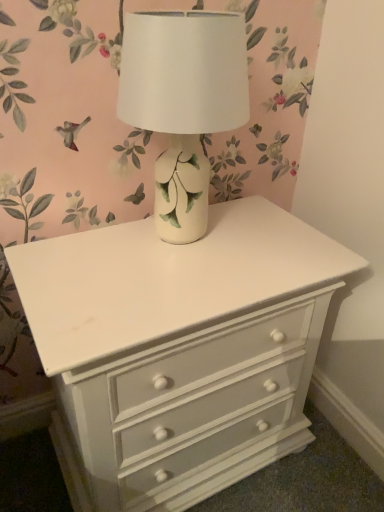
Question: From the image's perspective, does white painted wood chest of drawers at center appear lower than white ceramic table lamp at center?

Choices:
 (A) yes
 (B) no

Answer: (A)

Question: Can you confirm if white painted wood chest of drawers at center is thinner than white ceramic table lamp at center?

Choices:
 (A) no
 (B) yes

Answer: (A)

Question: Is white painted wood chest of drawers at center positioned with its back to white ceramic table lamp at center?

Choices:
 (A) yes
 (B) no

Answer: (B)

Question: From the image's perspective, is white painted wood chest of drawers at center above white ceramic table lamp at center?

Choices:
 (A) yes
 (B) no

Answer: (B)

Question: From a real-world perspective, does white painted wood chest of drawers at center stand above white ceramic table lamp at center?

Choices:
 (A) no
 (B) yes

Answer: (A)

Question: Can you confirm if white painted wood chest of drawers at center is shorter than white ceramic table lamp at center?

Choices:
 (A) yes
 (B) no

Answer: (B)

Question: Is white ceramic table lamp at center smaller than white painted wood chest of drawers at center?

Choices:
 (A) no
 (B) yes

Answer: (B)

Question: Is white ceramic table lamp at center further to camera compared to white painted wood chest of drawers at center?

Choices:
 (A) yes
 (B) no

Answer: (B)

Question: From a real-world perspective, is white ceramic table lamp at center positioned over white painted wood chest of drawers at center based on gravity?

Choices:
 (A) yes
 (B) no

Answer: (A)

Question: Are white ceramic table lamp at center and white painted wood chest of drawers at center far apart?

Choices:
 (A) no
 (B) yes

Answer: (A)

Question: Is white ceramic table lamp at center completely or partially outside of white painted wood chest of drawers at center?

Choices:
 (A) no
 (B) yes

Answer: (B)

Question: Can you confirm if white ceramic table lamp at center is wider than white painted wood chest of drawers at center?

Choices:
 (A) no
 (B) yes

Answer: (A)

Question: Considering the positions of white ceramic table lamp at center and white painted wood chest of drawers at center in the image, is white ceramic table lamp at center wider or thinner than white painted wood chest of drawers at center?

Choices:
 (A) wide
 (B) thin

Answer: (B)